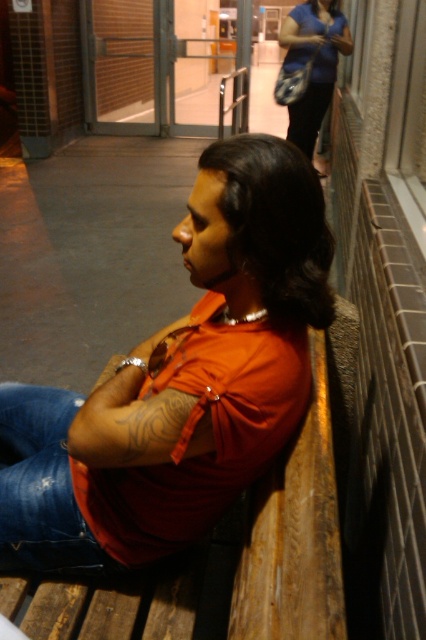
Does matte orange shirt at center come in front of blue denim jeans at lower left?

That is True.

This screenshot has height=640, width=426. Find the location of `matte orange shirt at center`. matte orange shirt at center is located at coordinates (180, 381).